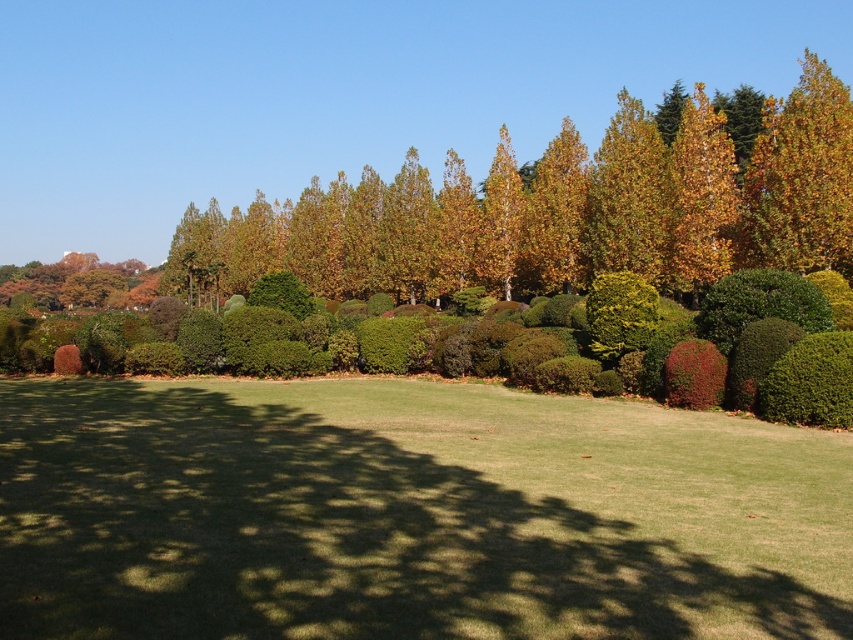
From the picture: You are a gardener looking at the park layout. You need to place a new decorative statue between the golden yellow leaves at upper center and the golden yellow leaves at upper right. Based on their positions, where should the statue be placed?

The golden yellow leaves at upper center is below golden yellow leaves at upper right, so the statue should be placed between them vertically, below the golden yellow leaves at upper right and above the golden yellow leaves at upper center.